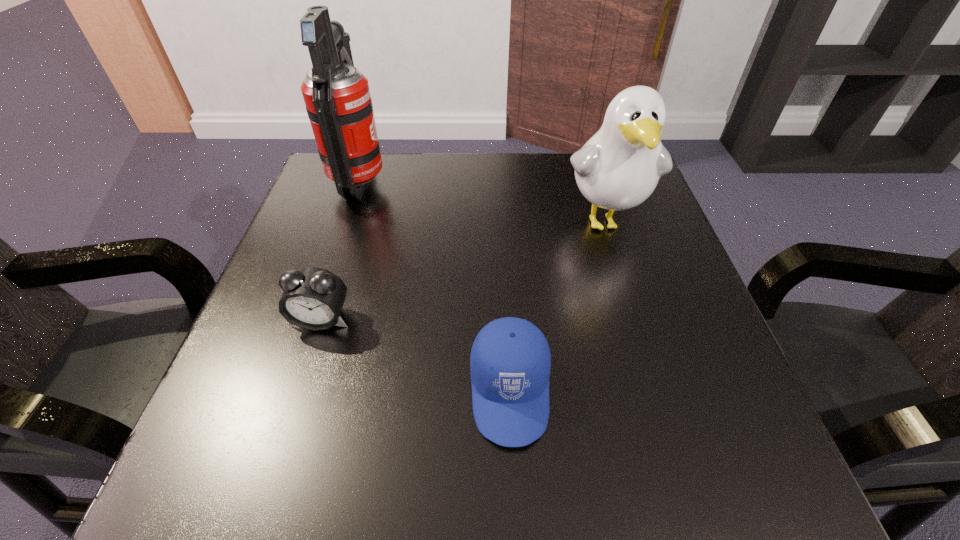
Locate an element on the screen. Image resolution: width=960 pixels, height=540 pixels. free space between the rightmost object and the second object from right to left is located at coordinates (557, 306).

At what (x,y) coordinates should I click in order to perform the action: click on free space between the cap and the tallest object. Please return your answer as a coordinate pair (x, y). Looking at the image, I should click on (435, 287).

Where is `vacant space in between the fire extinguisher and the alarm clock`? The image size is (960, 540). vacant space in between the fire extinguisher and the alarm clock is located at coordinates (340, 251).

Identify the location of object that stands as the closest to the gull. (510, 361).

Find the location of a particular element. The width and height of the screenshot is (960, 540). object that ranks as the second closest to the third object from left to right is located at coordinates (618, 168).